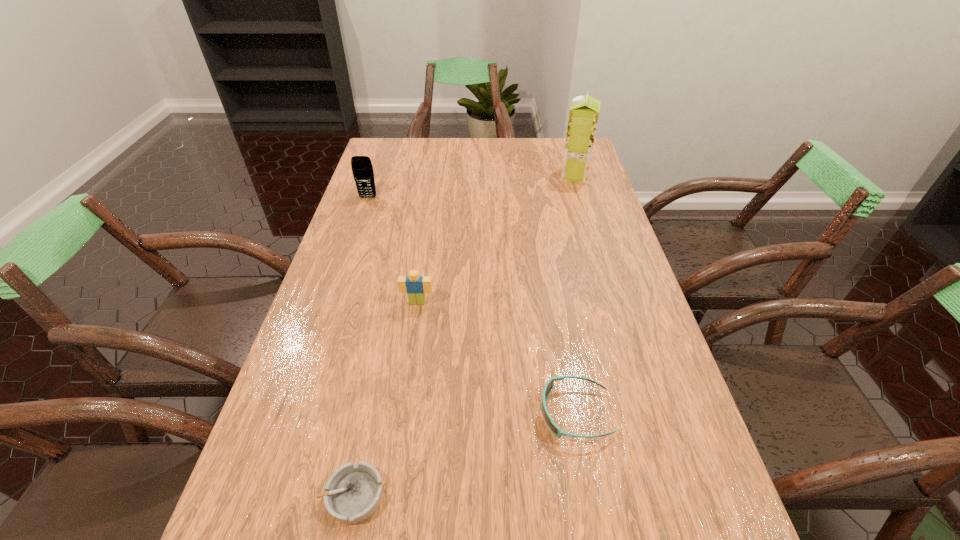
You are a GUI agent. You are given a task and a screenshot of the screen. Output one action in this format:
    pyautogui.click(x=<x>, y=<y>)
    Task: Click on the free location located on the front of the soya milk
    
    Given the screenshot: What is the action you would take?
    pyautogui.click(x=599, y=255)

Locate an element on the screen. The height and width of the screenshot is (540, 960). free location located on the screen of the fourth nearest object is located at coordinates (360, 221).

Identify the location of vacant area situated on the face of the Lego. (411, 348).

Where is `free location located on the front-facing side of the fourth object from left to right`? Image resolution: width=960 pixels, height=540 pixels. free location located on the front-facing side of the fourth object from left to right is located at coordinates (372, 413).

At what (x,y) coordinates should I click in order to perform the action: click on vacant space located 0.120m on the front-facing side of the fourth object from left to right. Please return your answer as a coordinate pair (x, y). The image size is (960, 540). Looking at the image, I should click on click(479, 413).

This screenshot has height=540, width=960. Identify the location of free region located on the front-facing side of the fourth object from left to right. (352, 413).

Where is `free spot located on the left of the nearest object`? This screenshot has width=960, height=540. free spot located on the left of the nearest object is located at coordinates (287, 496).

At what (x,y) coordinates should I click in order to perform the action: click on object that is at the far edge. Please return your answer as a coordinate pair (x, y). Looking at the image, I should click on (584, 111).

This screenshot has width=960, height=540. Identify the location of cellular telephone that is at the left edge. (x=362, y=169).

The width and height of the screenshot is (960, 540). Identify the location of ashtray that is at the left edge. (354, 492).